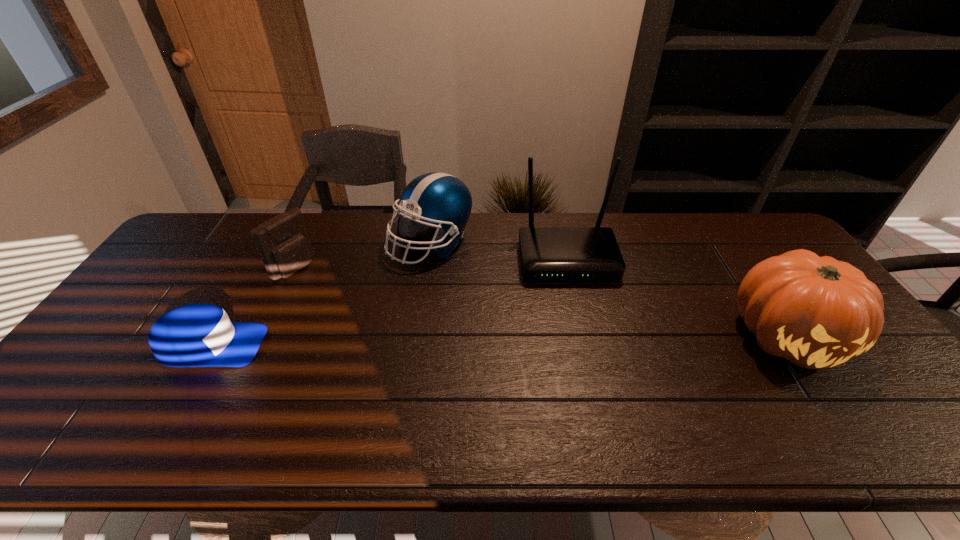
I want to click on blank area located 0.260m on the front-facing side of the second object from right to left, so click(x=588, y=355).

In order to click on free space located at the front of the third object from left to right with the faceguard in this screenshot , I will do `click(420, 345)`.

What are the coordinates of `free spot located 0.250m at the front of the third object from left to right with the faceguard` in the screenshot? It's located at (420, 336).

I want to click on vacant space located at the front of the third object from left to right with the faceguard, so click(x=425, y=291).

What are the coordinates of `free space located with an open flap on the pouch` in the screenshot? It's located at (401, 335).

Find the location of a particular element. vacant region located with an open flap on the pouch is located at coordinates (343, 299).

Identify the location of vacant point located with an open flap on the pouch. (338, 296).

The height and width of the screenshot is (540, 960). Identify the location of router positioned at the far edge. (547, 253).

Where is `football helmet positioned at the far edge`? The height and width of the screenshot is (540, 960). football helmet positioned at the far edge is located at coordinates (440, 200).

Where is `pouch located in the far edge section of the desktop`? This screenshot has height=540, width=960. pouch located in the far edge section of the desktop is located at coordinates (283, 242).